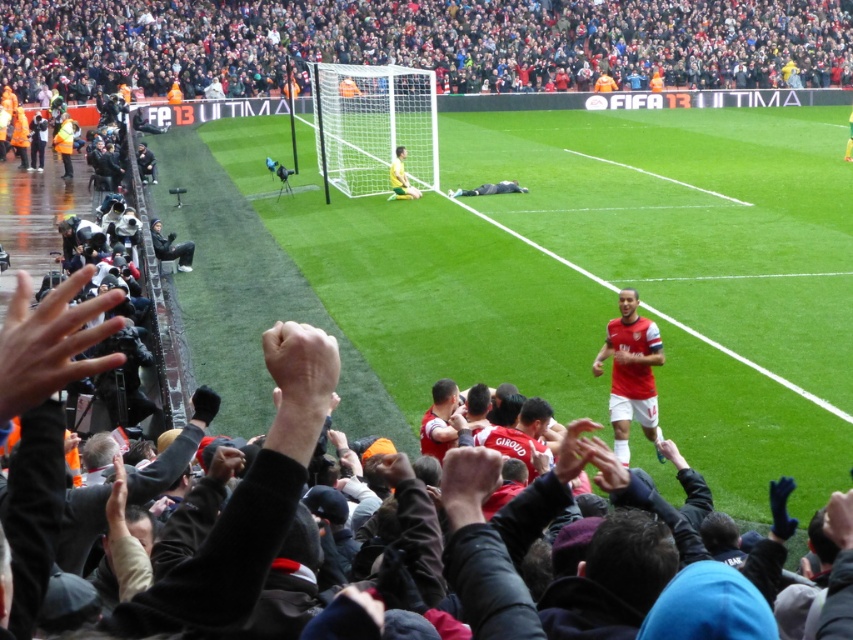
Who is more distant from viewer, (624, 51) or (624, 422)?

The point (624, 51) is more distant.

Is point (213, 61) positioned before point (647, 321)?

That is False.

At what (x,y) coordinates should I click in order to perform the action: click on red fabric crowd at upper center. Please return your answer as a coordinate pair (x, y). Image resolution: width=853 pixels, height=640 pixels. Looking at the image, I should click on (421, 42).

Can you confirm if red matte jersey at center is positioned to the left of black leather jacket at left?

Incorrect, red matte jersey at center is not on the left side of black leather jacket at left.

Is point (625, 346) farther from viewer compared to point (177, 262)?

No, (625, 346) is closer to viewer.

Where is `red matte jersey at center`? This screenshot has height=640, width=853. red matte jersey at center is located at coordinates (631, 372).

Is point (614, 243) positioned behind point (189, 252)?

Yes.

Who is lower down, green grass football field at center or black leather jacket at left?

Positioned lower is black leather jacket at left.

Measure the distance between green grass football field at center and camera.

green grass football field at center and camera are 10.80 meters apart from each other.

The height and width of the screenshot is (640, 853). Identify the location of green grass football field at center. (689, 218).